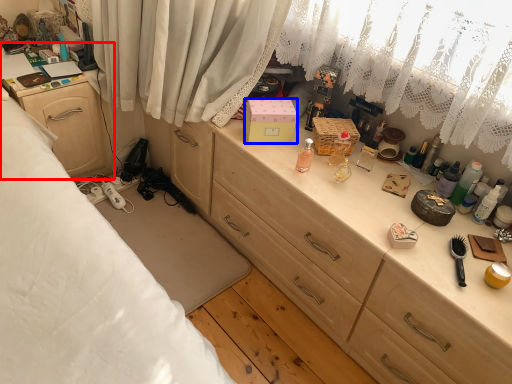
Question: Which object is further to the camera taking this photo, cabinetry (highlighted by a red box) or box (highlighted by a blue box)?

Choices:
 (A) cabinetry
 (B) box

Answer: (A)